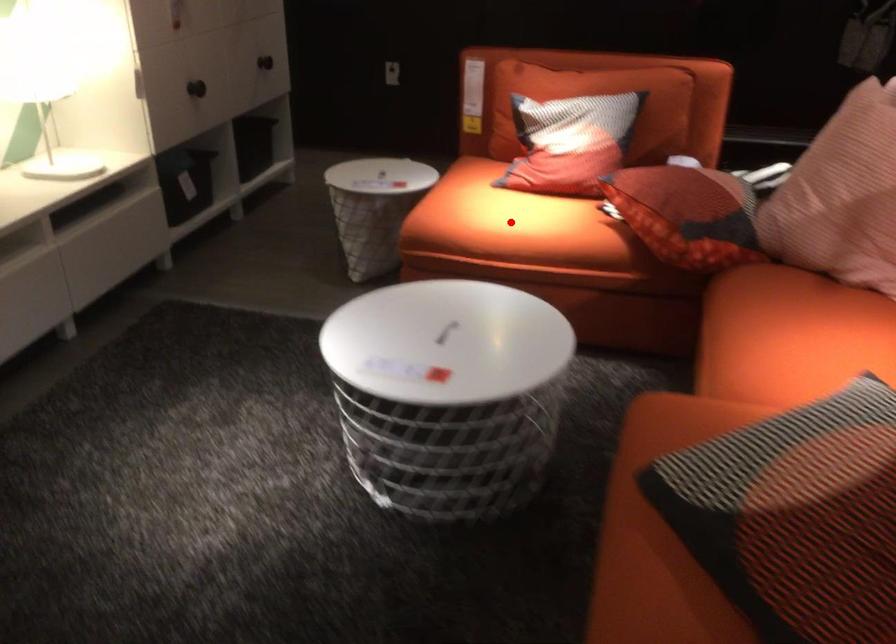
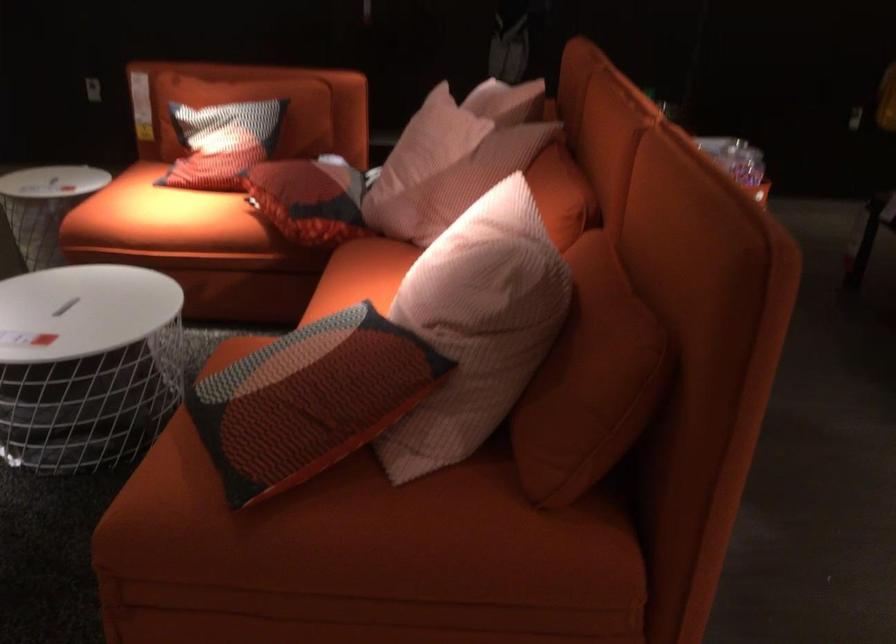
Question: A red point is marked in image1. In image2, is the corresponding 3D point closer to the camera or farther? Reply with the corresponding letter.

Choices:
 (A) The corresponding 3D point is closer.
 (B) The corresponding 3D point is farther.

Answer: (B)